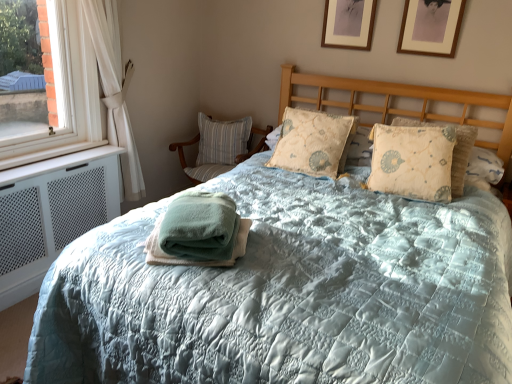
The height and width of the screenshot is (384, 512). What are the coordinates of `free space above white mesh air conditioner at left (from a real-world perspective)` in the screenshot? It's located at (59, 156).